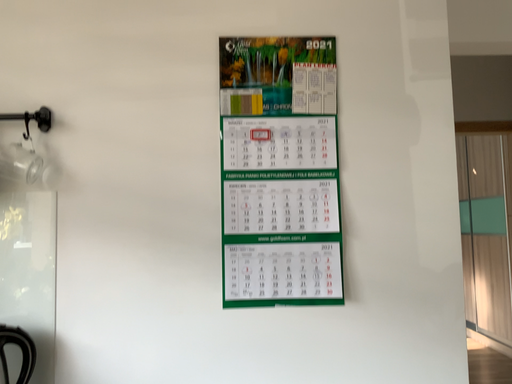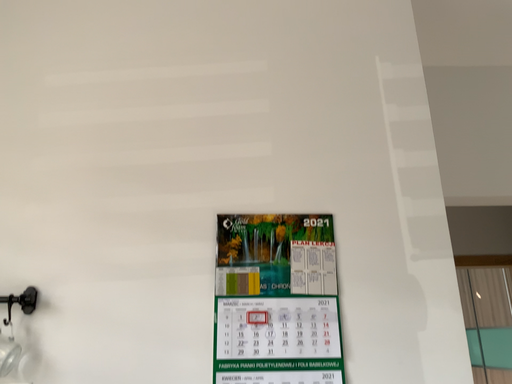
Question: Which way did the camera rotate in the video?

Choices:
 (A) rotated upward
 (B) rotated downward

Answer: (A)